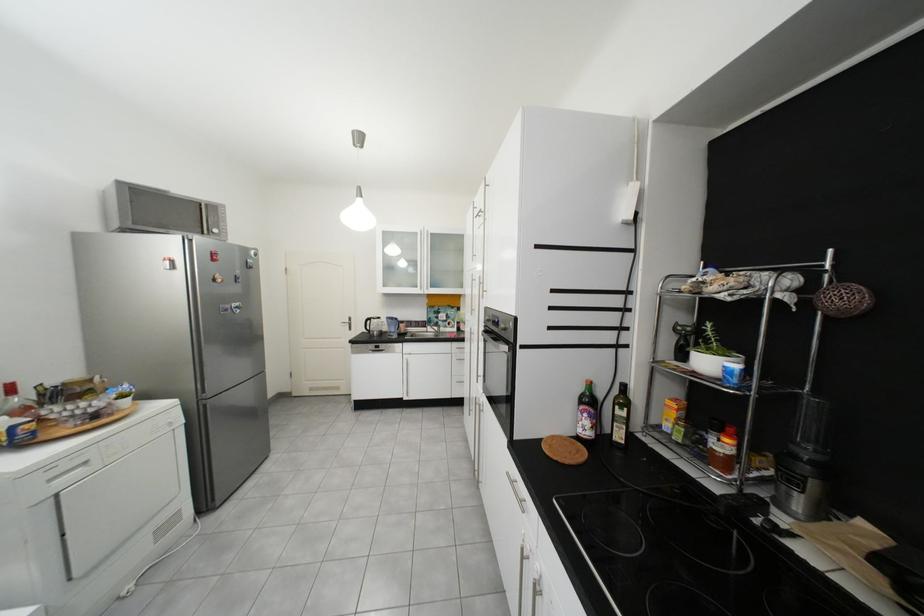
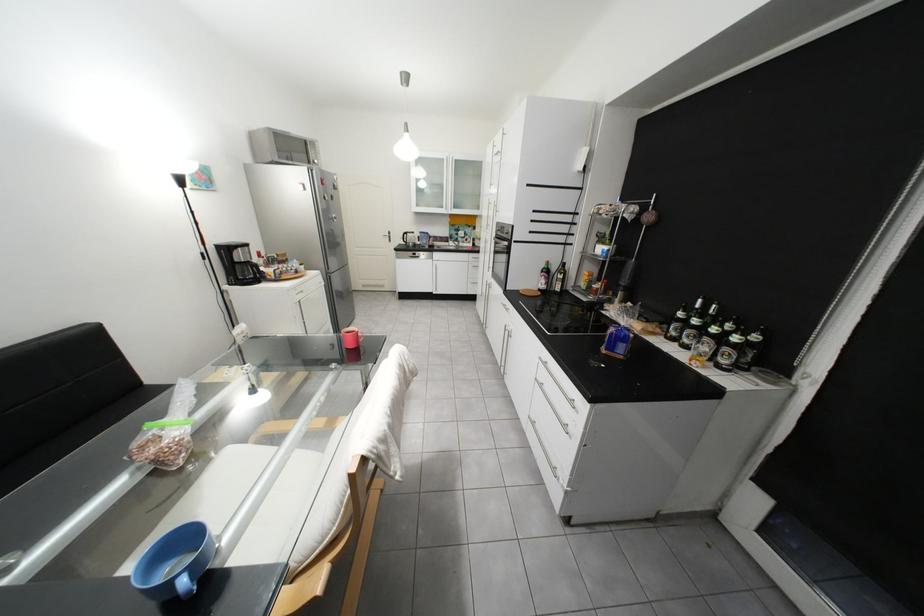
In the second image, find the point that corresponds to [184,262] in the first image.

(315, 185)